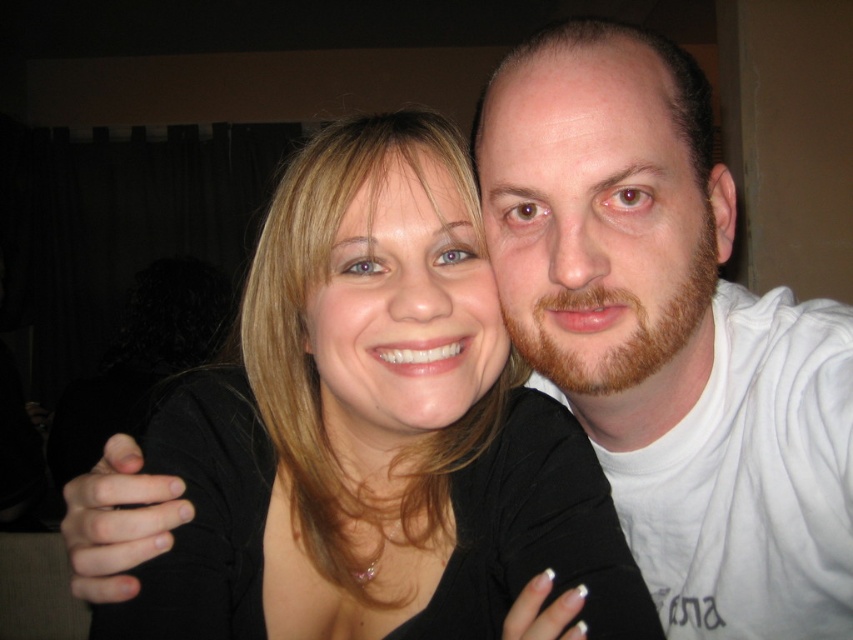
Identify the location of black matte hair at center. The width and height of the screenshot is (853, 640). (373, 428).

Is black matte hair at center further to camera compared to white cotton shirt at upper right?

That is False.

Between point (485, 573) and point (705, 109), which one is positioned behind?

Point (485, 573)

Where is `black matte hair at center`? black matte hair at center is located at coordinates (373, 428).